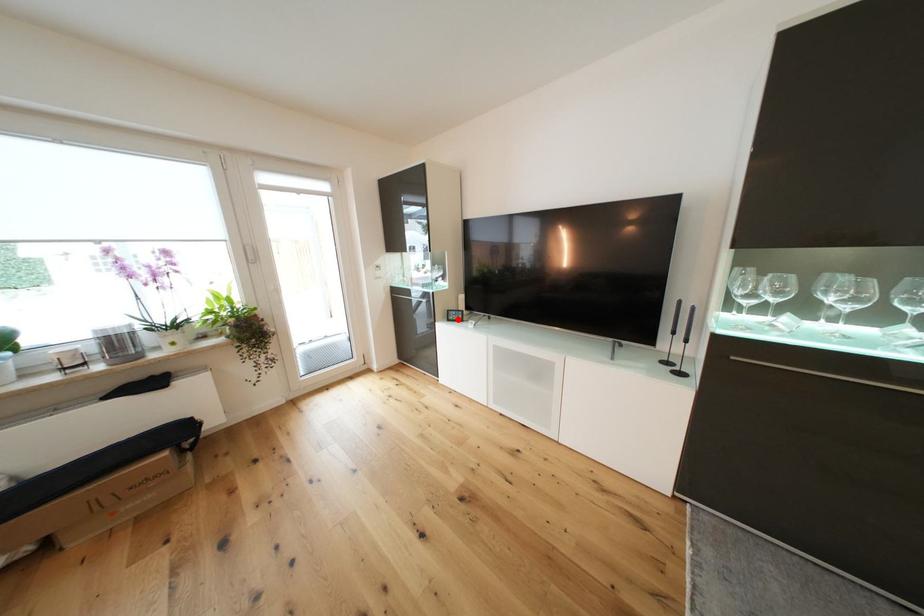
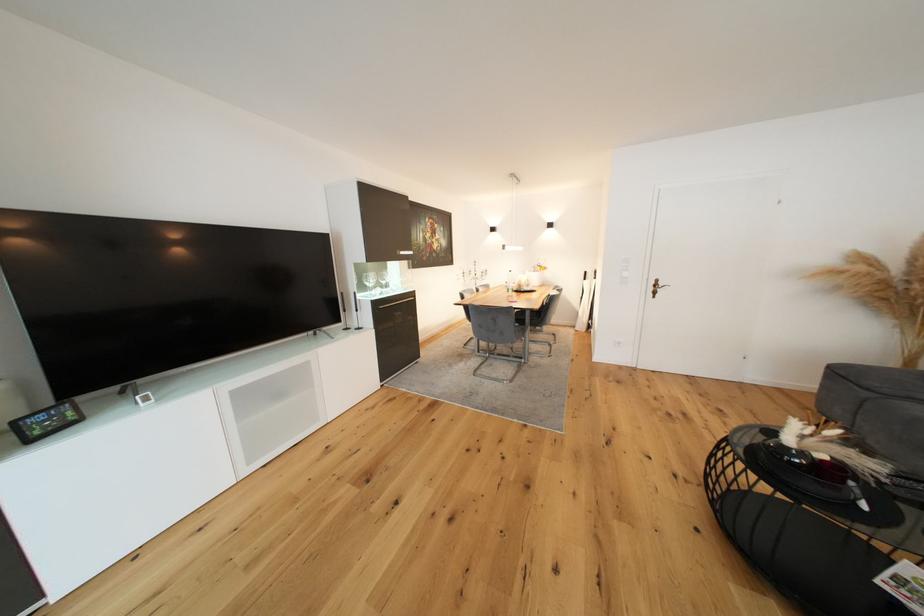
Locate, in the second image, the point that corresponds to the highlighted location in the first image.

(44, 434)